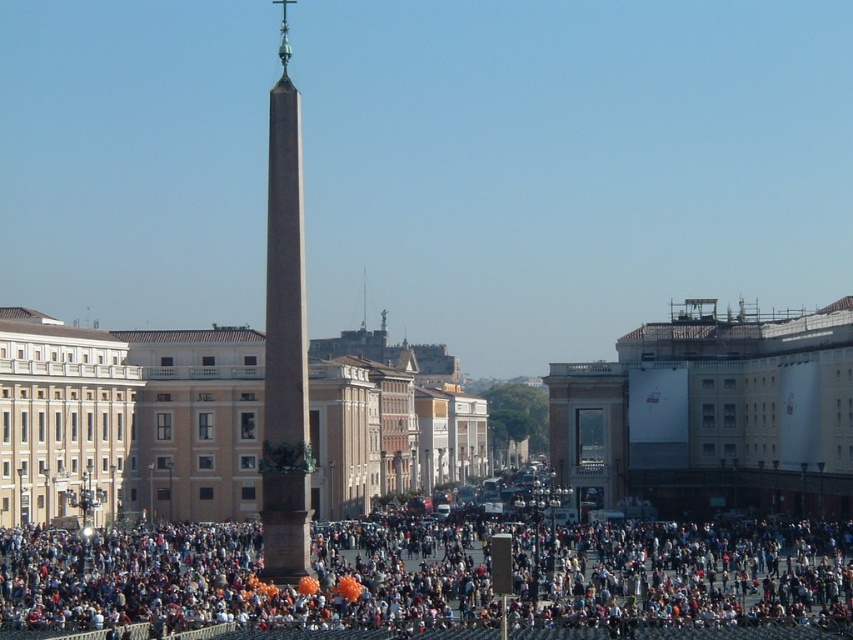
You are an architect visiting the square and want to compare the two central structures. Which one is larger in size between the brown polished stone obelisk at center and the smooth stone spire at center?

The brown polished stone obelisk at center is bigger than the smooth stone spire at center, so the brown polished stone obelisk at center is larger in size.

You are an architect examining the public square. You notice two structures at the center of the square. One is the brown polished stone obelisk at center and the other is the smooth stone spire at center. Which of these two structures is taller?

The brown polished stone obelisk at center is much taller than the smooth stone spire at center.